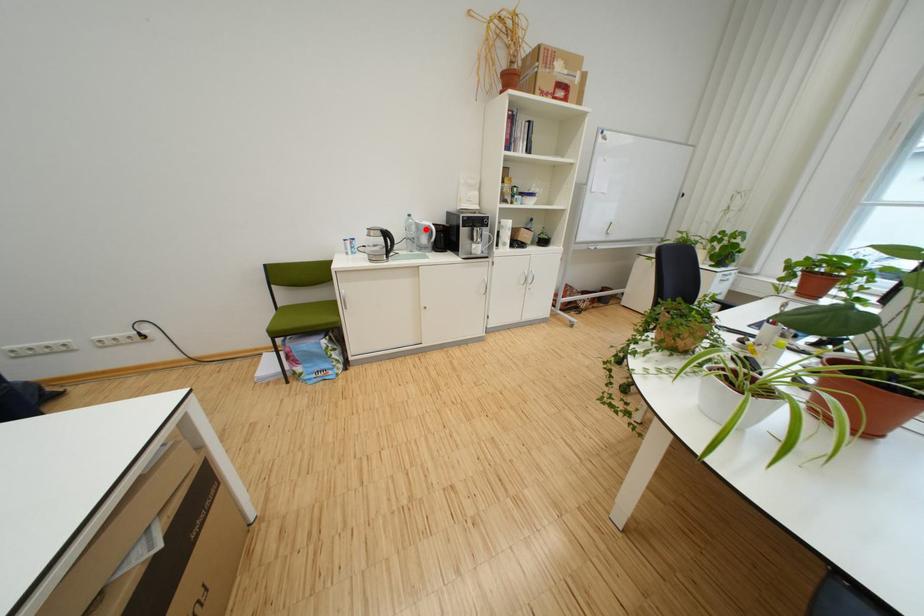
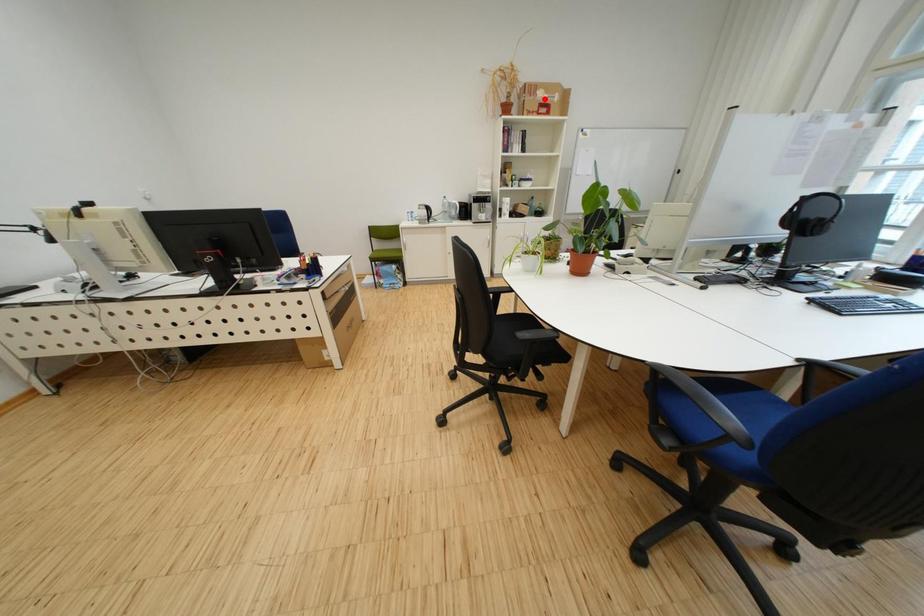
I am providing you with two images of the same scene from different viewpoints. A red point is marked on the first image and another point is marked on the second image. Is the red point in image1 aligned with the point shown in image2?

No